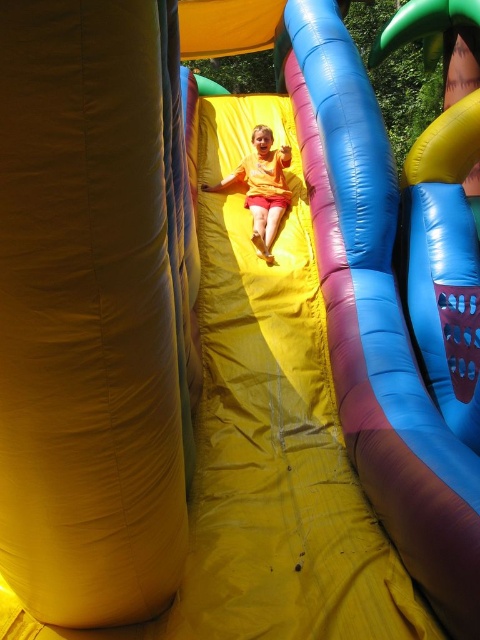
Question: Which of the following is the closest to the observer?

Choices:
 (A) yellow matte shorts at center
 (B) yellow fabric slide at center

Answer: (B)

Question: Is yellow fabric slide at center closer to camera compared to yellow matte shorts at center?

Choices:
 (A) no
 (B) yes

Answer: (B)

Question: Does yellow fabric slide at center appear on the left side of yellow matte shorts at center?

Choices:
 (A) yes
 (B) no

Answer: (B)

Question: Which object appears farthest from the camera in this image?

Choices:
 (A) yellow matte shorts at center
 (B) yellow fabric slide at center

Answer: (A)

Question: Is yellow fabric slide at center above yellow matte shorts at center?

Choices:
 (A) no
 (B) yes

Answer: (A)